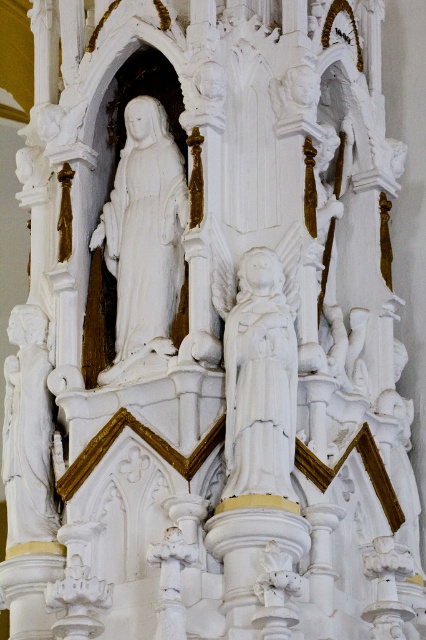
Question: Which object appears closest to the camera in this image?

Choices:
 (A) white marble statue at center
 (B) white marble statue at upper left
 (C) white stone statue at left

Answer: (A)

Question: Can you confirm if white marble statue at upper left is positioned to the left of white stone statue at left?

Choices:
 (A) no
 (B) yes

Answer: (A)

Question: Can you confirm if white marble statue at center is thinner than white stone statue at left?

Choices:
 (A) yes
 (B) no

Answer: (A)

Question: Which object is positioned farthest from the white stone statue at left?

Choices:
 (A) white marble statue at upper left
 (B) white marble statue at center

Answer: (B)

Question: Observing the image, what is the correct spatial positioning of white marble statue at upper left in reference to white marble statue at center?

Choices:
 (A) below
 (B) above

Answer: (B)

Question: Which of the following is the closest to the observer?

Choices:
 (A) white stone statue at left
 (B) white marble statue at center

Answer: (B)